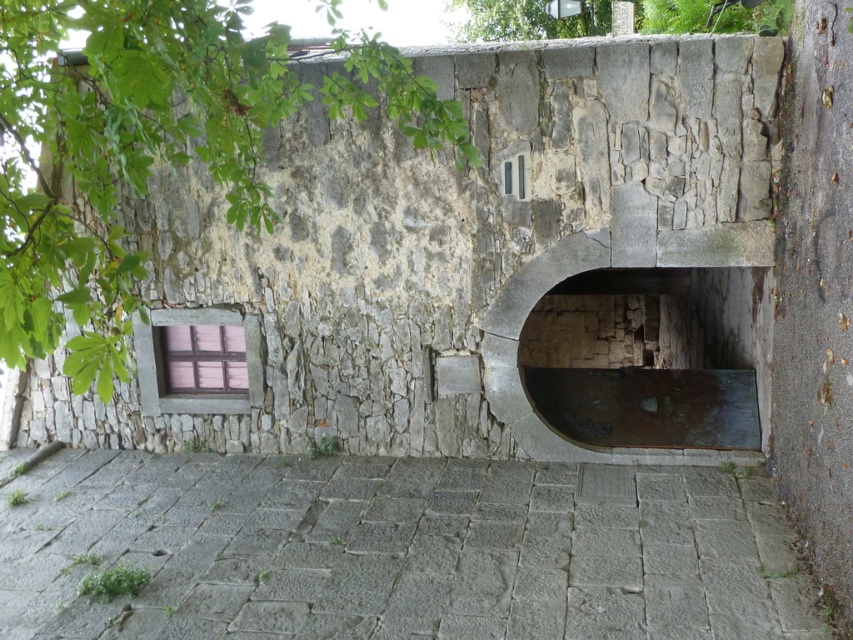
Measure the distance from bronze metallic archway at center to green leafy tree at upper center.

bronze metallic archway at center and green leafy tree at upper center are 3.22 meters apart.

Is bronze metallic archway at center above green leafy tree at upper center?

Actually, bronze metallic archway at center is below green leafy tree at upper center.

Is point (650, 433) behind point (573, 17)?

No.

The image size is (853, 640). In order to click on bronze metallic archway at center in this screenshot , I will do `click(634, 365)`.

Between gray stone alley at center and green leafy tree at upper left, which one has less height?

Standing shorter between the two is gray stone alley at center.

Can you confirm if gray stone alley at center is positioned below green leafy tree at upper left?

Indeed, gray stone alley at center is positioned under green leafy tree at upper left.

Image resolution: width=853 pixels, height=640 pixels. What do you see at coordinates (399, 550) in the screenshot?
I see `gray stone alley at center` at bounding box center [399, 550].

Find the location of a particular element. Image resolution: width=853 pixels, height=640 pixels. gray stone alley at center is located at coordinates (399, 550).

Does rusty metal door at center appear over bronze metallic archway at center?

No.

Is point (531, 157) less distant than point (541, 419)?

Yes, point (531, 157) is closer to viewer.

Image resolution: width=853 pixels, height=640 pixels. Identify the location of rusty metal door at center. (444, 250).